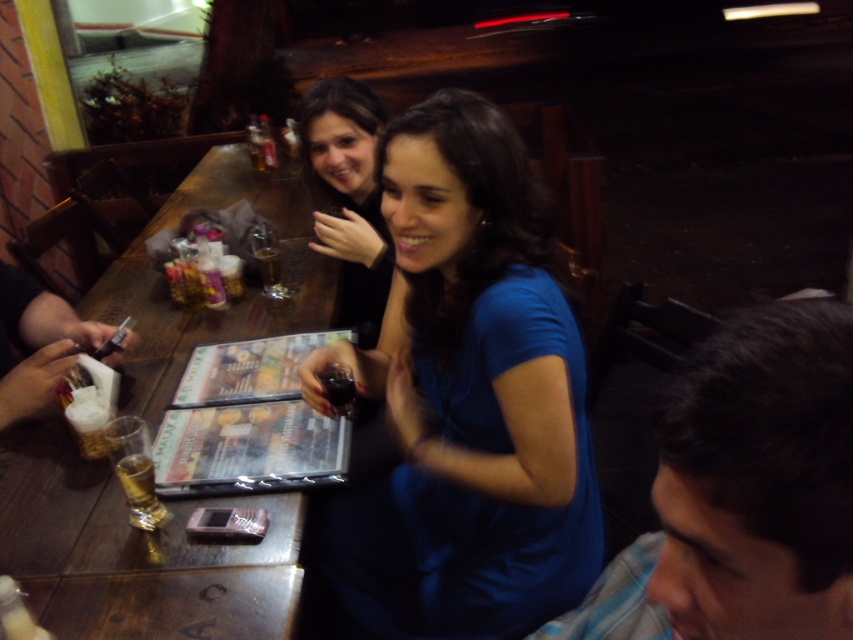
You are sitting at the wooden table in the foreground of the outdoor restaurant. You notice two points marked on the table. The first point is at coordinates point (x=387, y=355) and the second is at point (x=733, y=504). If you want to place a small salt shaker between them, which point should you place it closer to so it doesn

The point (x=387, y=355) is behind point (x=733, y=504), so placing the salt shaker closer to point (x=733, y=504) would position it between the two points.

You are a customer at this outdoor evening cafe. You want to place your matte black dress at center on the wooden table at center so it won

The wooden table at center is located below the matte black dress at center, so placing the matte black dress at center on the wooden table at center would require moving the dress downward since the table is positioned beneath it.

You are a photographer trying to capture a closeup shot of an object in the scene. You have two points marked as potential focus points. The first point is at coordinates point (x=495, y=556) and the second is at point (x=254, y=240). Which point should you choose to ensure the closest object to the camera is in focus?

Point (x=495, y=556) is closer to the camera than point (x=254, y=240), so you should choose point (x=495, y=556) to ensure the closest object to the camera is in focus.